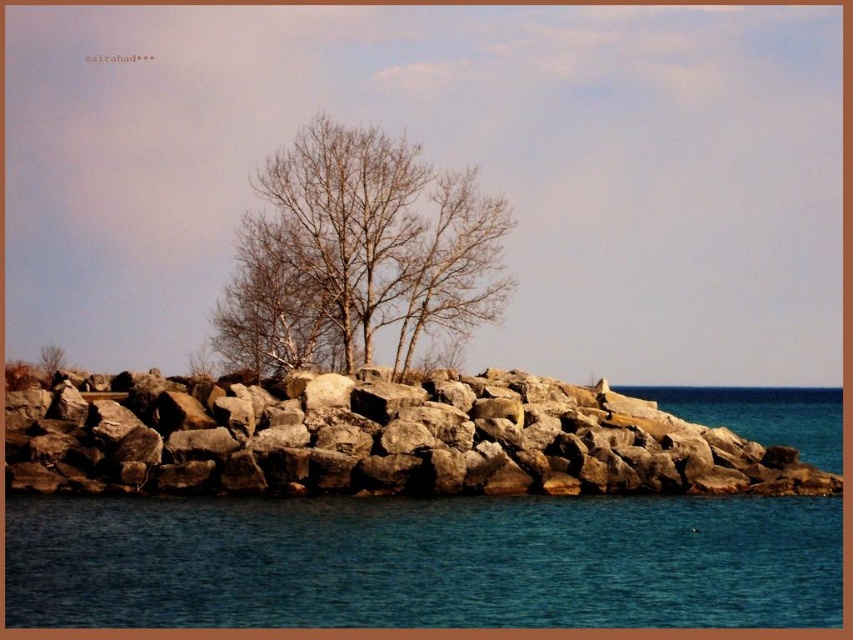
Question: Does blue water at lower center have a smaller size compared to brown rough rocks at center?

Choices:
 (A) yes
 (B) no

Answer: (A)

Question: Is blue water at lower center positioned in front of bare branches at center?

Choices:
 (A) no
 (B) yes

Answer: (B)

Question: Among these points, which one is nearest to the camera?

Choices:
 (A) (254, 216)
 (B) (465, 476)
 (C) (695, 593)

Answer: (C)

Question: Which point is farther to the camera?

Choices:
 (A) (486, 232)
 (B) (62, 588)

Answer: (A)

Question: Is blue water at lower center to the left of bare branches at center from the viewer's perspective?

Choices:
 (A) yes
 (B) no

Answer: (B)

Question: Which object is farther from the camera taking this photo?

Choices:
 (A) brown rough rocks at center
 (B) blue water at lower center
 (C) bare branches at center

Answer: (C)